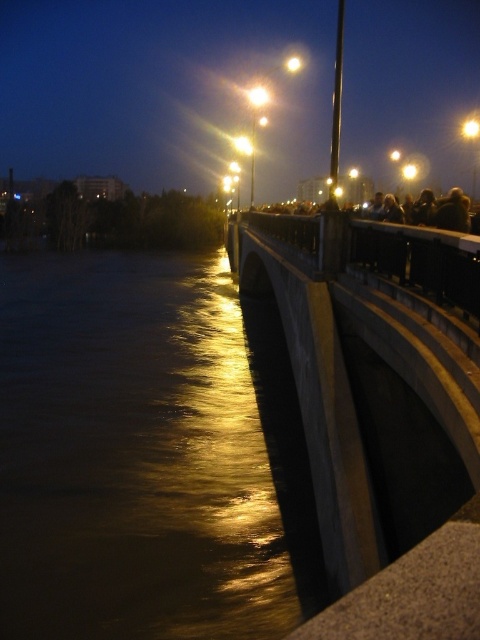
Can you confirm if metallic bridge at center is positioned to the left of concrete at center?

Indeed, metallic bridge at center is positioned on the left side of concrete at center.

Does metallic bridge at center have a greater height compared to concrete at center?

Indeed, metallic bridge at center has a greater height compared to concrete at center.

The width and height of the screenshot is (480, 640). What do you see at coordinates (165, 90) in the screenshot?
I see `metallic bridge at center` at bounding box center [165, 90].

Where is `metallic bridge at center`? Image resolution: width=480 pixels, height=640 pixels. metallic bridge at center is located at coordinates (165, 90).

Measure the distance from golden reflective water at lower left to concrete at center.

golden reflective water at lower left and concrete at center are 5.47 meters apart from each other.

Is golden reflective water at lower left bigger than concrete at center?

Indeed, golden reflective water at lower left has a larger size compared to concrete at center.

Find the location of a particular element. golden reflective water at lower left is located at coordinates (148, 452).

Is golden reflective water at lower left shorter than metallic bridge at center?

Indeed, golden reflective water at lower left has a lesser height compared to metallic bridge at center.

Identify the location of golden reflective water at lower left. The height and width of the screenshot is (640, 480). (148, 452).